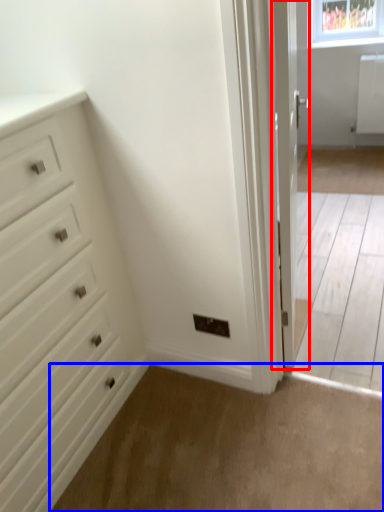
Question: Which object is closer to the camera taking this photo, door (highlighted by a red box) or plain (highlighted by a blue box)?

Choices:
 (A) door
 (B) plain

Answer: (B)